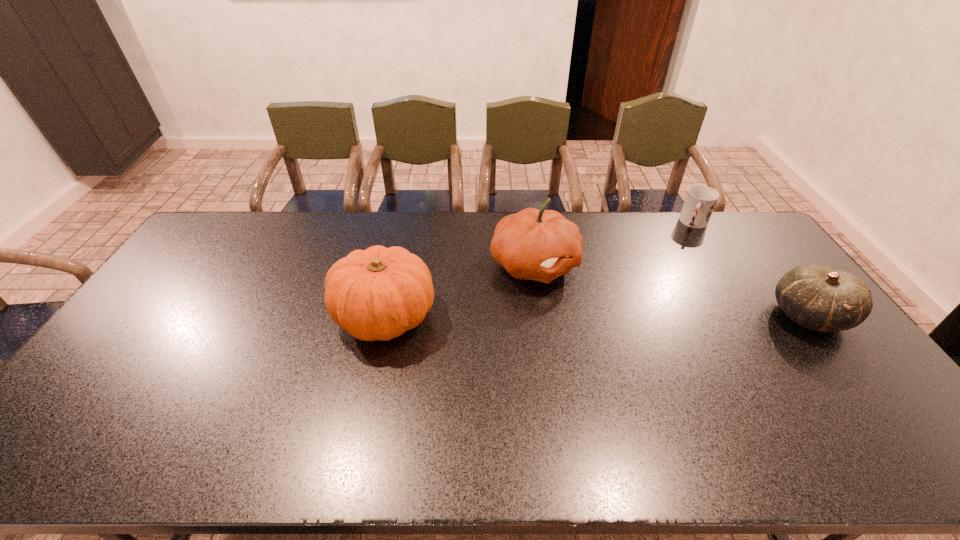
The width and height of the screenshot is (960, 540). In the image, there is a desktop. In order to click on vacant space at the near edge in this screenshot , I will do `click(204, 408)`.

Locate an element on the screen. The height and width of the screenshot is (540, 960). free space at the left edge of the desktop is located at coordinates (105, 370).

Identify the location of vacant area that lies between the third object from left to right and the right pumpkin. (614, 244).

Identify the location of free space between the leftmost object and the right pumpkin. Image resolution: width=960 pixels, height=540 pixels. (460, 290).

You are a GUI agent. You are given a task and a screenshot of the screen. Output one action in this format:
    pyautogui.click(x=<x>, y=<y>)
    Task: Click on the free space between the second object from left to right and the rightmost object
    This screenshot has width=960, height=540.
    Given the screenshot: What is the action you would take?
    pyautogui.click(x=672, y=290)

The height and width of the screenshot is (540, 960). In order to click on free space between the rightmost object and the leftmost object in this screenshot , I will do `click(597, 315)`.

Find the location of a particular element. Image resolution: width=960 pixels, height=540 pixels. free space that is in between the rightmost object and the right pumpkin is located at coordinates (672, 290).

Locate an element on the screen. The width and height of the screenshot is (960, 540). free space between the cup and the second shortest object is located at coordinates (752, 269).

Identify the location of vacant space that is in between the left pumpkin and the rightmost object. The height and width of the screenshot is (540, 960). (597, 315).

You are a GUI agent. You are given a task and a screenshot of the screen. Output one action in this format:
    pyautogui.click(x=<x>, y=<y>)
    Task: Click on the object that is the third closest to the left pumpkin
    
    Given the screenshot: What is the action you would take?
    pyautogui.click(x=819, y=298)